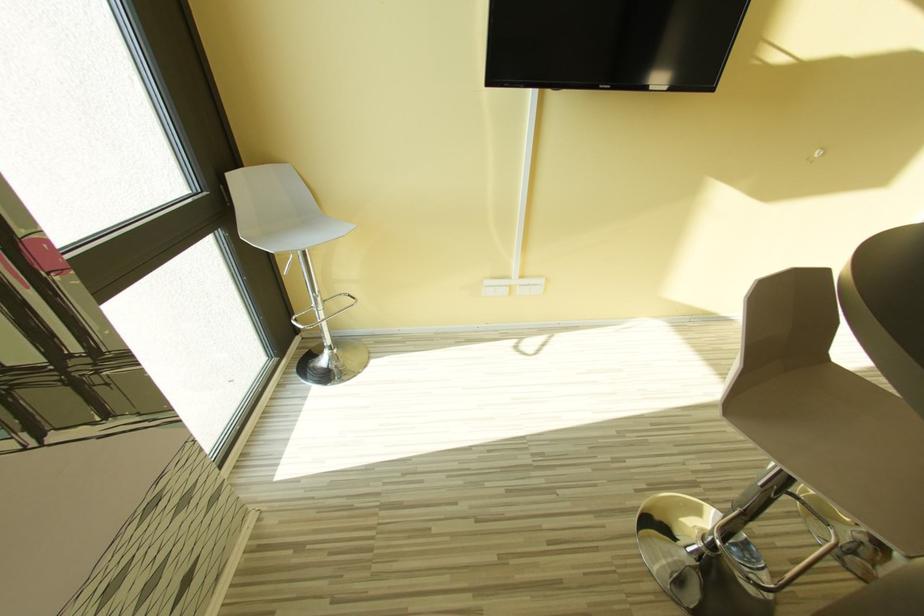
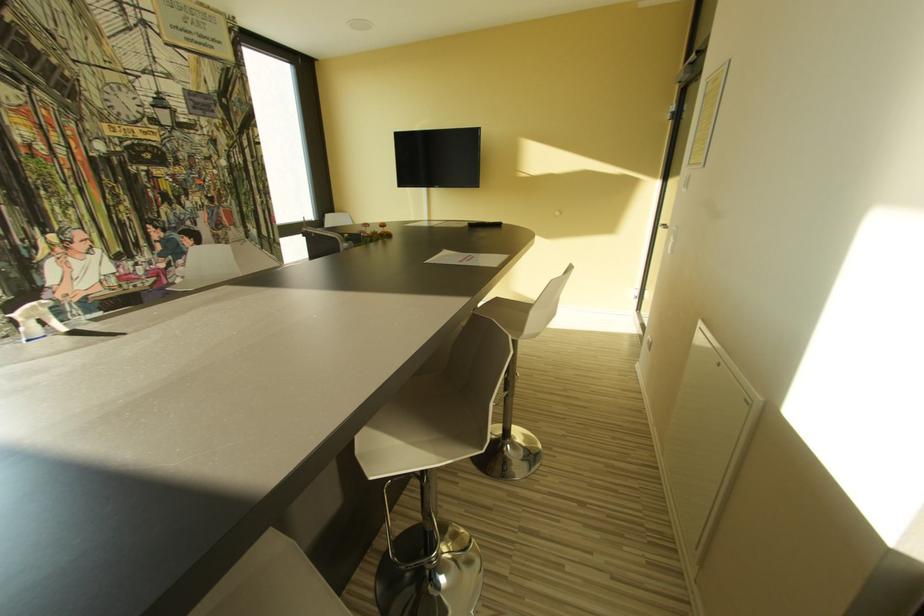
Which direction would the cameraman need to move to produce the second image?

The cameraman walked toward right, backward.